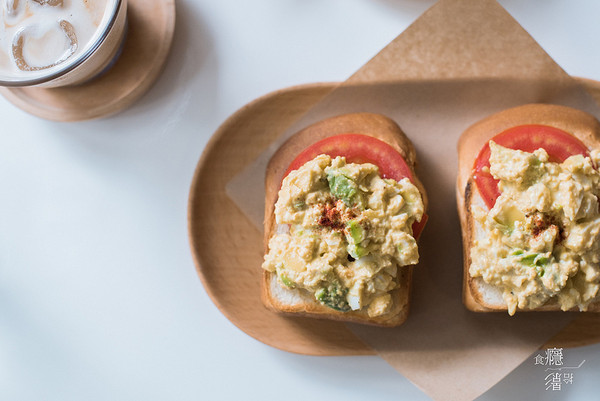
What are the coordinates of `coaster` in the screenshot? It's located at (81, 106).